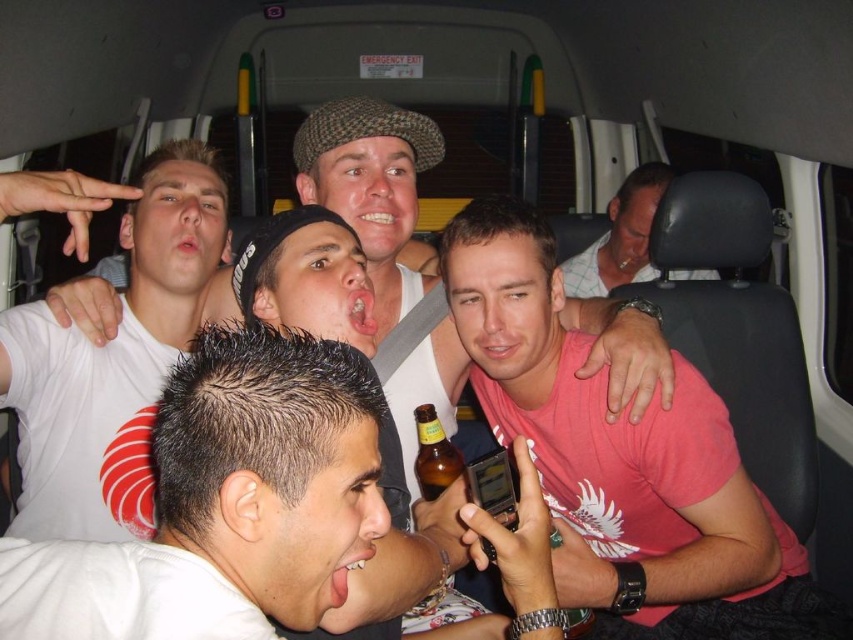
Is the position of pink matte shirt at center more distant than that of brown glass bottle at center?

No, pink matte shirt at center is in front of brown glass bottle at center.

Which is behind, point (578, 493) or point (439, 429)?

The point (578, 493) is more distant.

Does point (496, 317) come closer to viewer compared to point (433, 497)?

Yes, point (496, 317) is in front of point (433, 497).

This screenshot has height=640, width=853. What are the coordinates of `pink matte shirt at center` in the screenshot? It's located at (624, 461).

Between point (616, 246) and point (428, 460), which one is positioned behind?

The point (616, 246) is more distant.

Between white shirt at center and brown glass bottle at center, which one appears on the right side from the viewer's perspective?

Positioned to the right is white shirt at center.

Is point (583, 278) positioned in front of point (425, 449)?

No.

This screenshot has width=853, height=640. Identify the location of white shirt at center. (621, 237).

This screenshot has width=853, height=640. What do you see at coordinates (624, 461) in the screenshot?
I see `pink matte shirt at center` at bounding box center [624, 461].

Who is higher up, pink matte shirt at center or white t-shirt at upper left?

white t-shirt at upper left is higher up.

This screenshot has width=853, height=640. Identify the location of pink matte shirt at center. (624, 461).